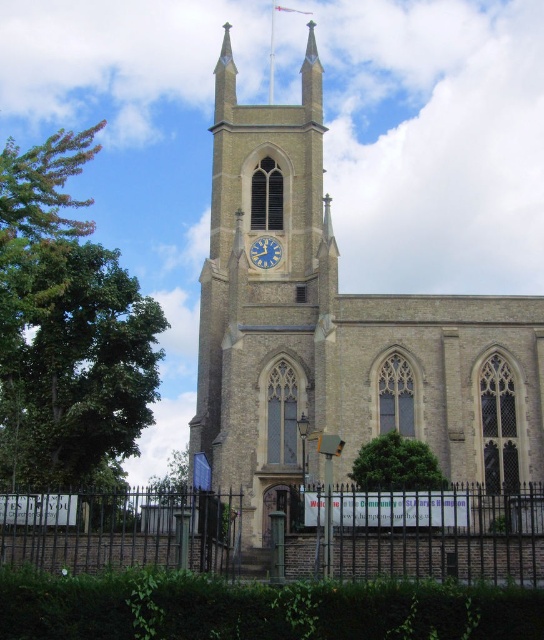
Consider the image. Who is positioned more to the left, beige stone clock tower at center or black metal fence at lower center?

beige stone clock tower at center

Can you confirm if beige stone clock tower at center is shorter than black metal fence at lower center?

In fact, beige stone clock tower at center may be taller than black metal fence at lower center.

You are a GUI agent. You are given a task and a screenshot of the screen. Output one action in this format:
    pyautogui.click(x=<x>, y=<y>)
    Task: Click on the beige stone clock tower at center
    
    Given the screenshot: What is the action you would take?
    pyautogui.click(x=265, y=291)

The height and width of the screenshot is (640, 544). I want to click on beige stone clock tower at center, so click(x=265, y=291).

Measure the distance from black metal fence at lower center to blue metallic clock at center.

The distance of black metal fence at lower center from blue metallic clock at center is 37.16 meters.

Can you confirm if black metal fence at lower center is shorter than blue metallic clock at center?

No.

Does point (454, 509) come behind point (275, 243)?

No, it is not.

Locate an element on the screen. black metal fence at lower center is located at coordinates (128, 532).

Can you confirm if beige stone church at center is bigger than blue metallic clock at center?

Yes.

Does point (305, 433) come behind point (256, 244)?

No.

Where is `beige stone church at center`? Image resolution: width=544 pixels, height=640 pixels. beige stone church at center is located at coordinates (337, 332).

Find the location of a particular element. This screenshot has height=640, width=544. beige stone church at center is located at coordinates (337, 332).